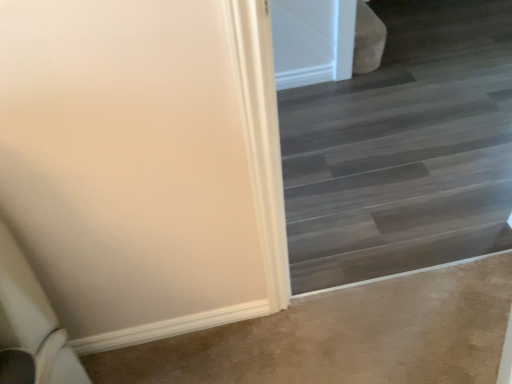
You are a GUI agent. You are given a task and a screenshot of the screen. Output one action in this format:
    pyautogui.click(x=<x>, y=<y>)
    Task: Click on the free space above brown carpet at lower left (from a real-world perspective)
    The width and height of the screenshot is (512, 384).
    Given the screenshot: What is the action you would take?
    pyautogui.click(x=330, y=334)